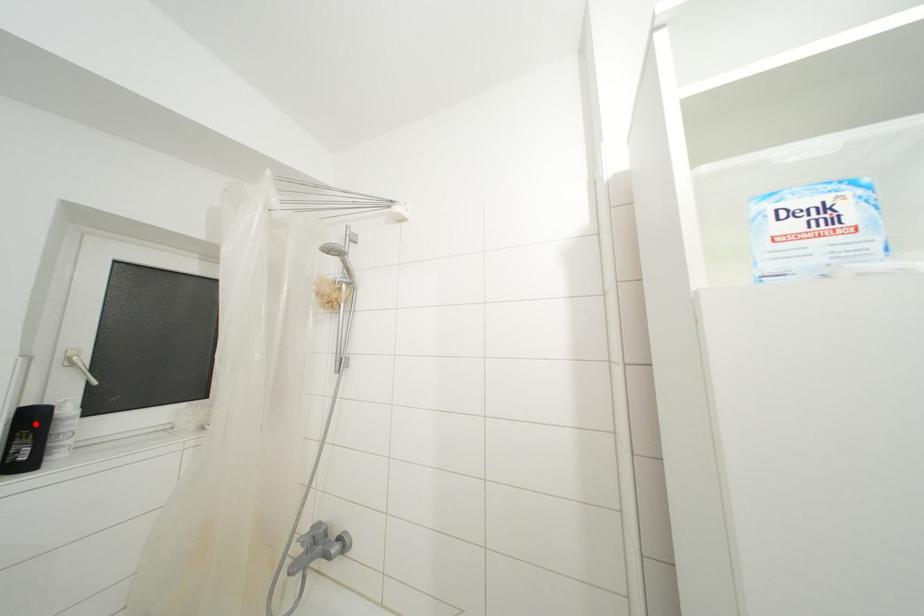
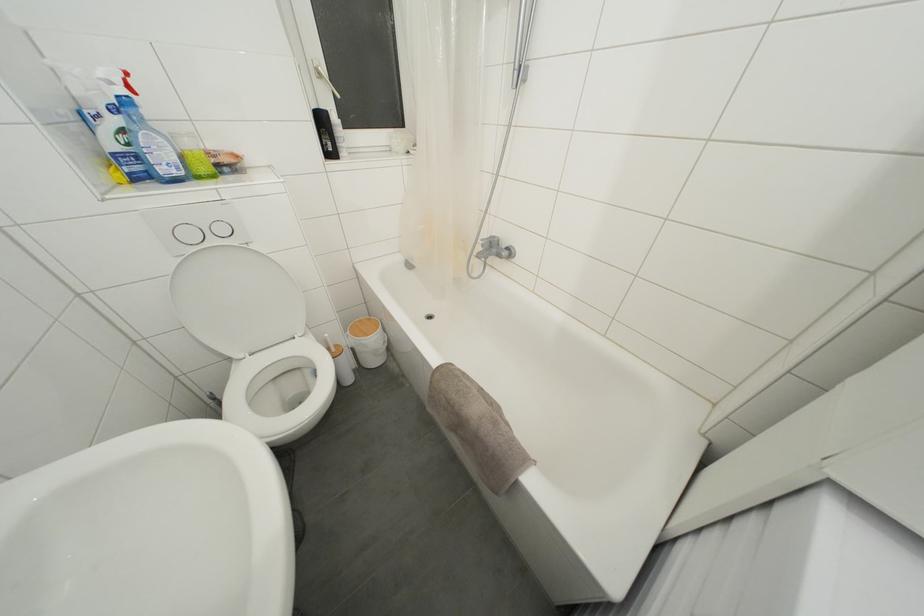
Locate, in the second image, the point that corresponds to the highlighted location in the first image.

(325, 126)